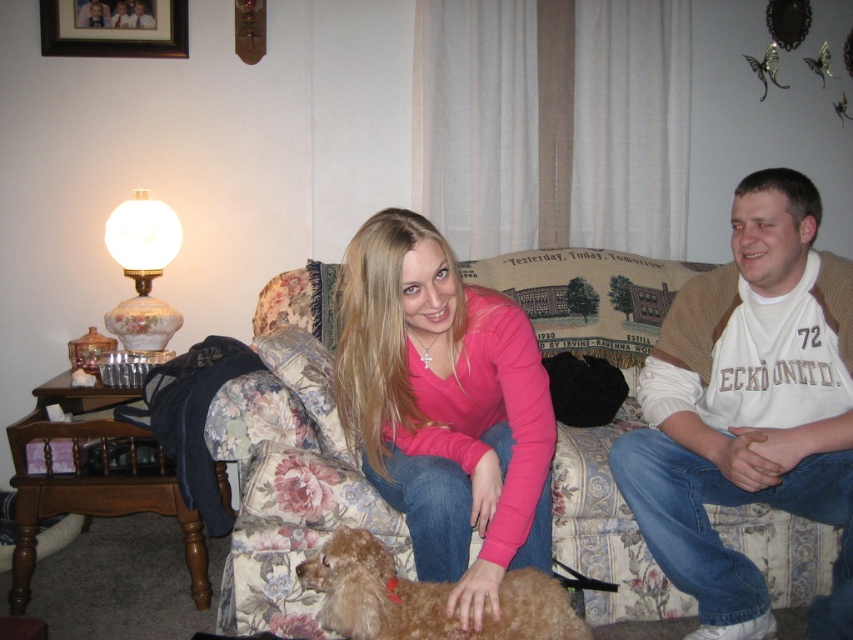
You are designing a layout for a magazine article about home decor. You need to place a photo of the white cotton shirt at center and the brushed metal picture frame at upper left side by side in a horizontal layout. Given their widths, which object should be placed on the left side to ensure the layout looks balanced?

The white cotton shirt at center has a greater width than the brushed metal picture frame at upper left. To create a balanced horizontal layout, place the wider white cotton shirt at center on the left side so that the narrower brushed metal picture frame at upper left can be positioned to its right, maintaining visual equilibrium.

You are standing in the living room and want to grab the white cotton shirt at center. Considering your height is 5 feet 6 inches, can you comfortably reach it?

The white cotton shirt at center is 5.66 feet from viewer, which is approximately 68 inches. Since your height is 5 feet 6 inches, which is 66 inches, you may need to stretch slightly to reach it, but it should be within your reach.

You are a photographer setting up a shoot in this living room. You need to ensure that the white cotton shirt at center and the light brown fur at lower center are both visible in the frame. Based on their positions, which object should you prioritize keeping in focus to ensure both are clearly visible?

The white cotton shirt at center is located above light brown fur at lower center. To ensure both are clearly visible, prioritize keeping the light brown fur at lower center in focus since it is closer to the camera, allowing the shirt above it to remain in focus as well.